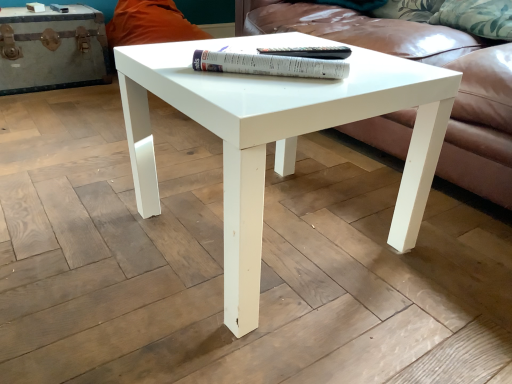
Question: Is white paper at center, the second paperback book when ordered from back to front, located within white leather chest at left?

Choices:
 (A) yes
 (B) no

Answer: (B)

Question: From a real-world perspective, is white leather chest at left below white paper at center, which ranks as the 1th paperback book in front-to-back order?

Choices:
 (A) yes
 (B) no

Answer: (A)

Question: Considering the relative sizes of white leather chest at left and white paper at center, the second paperback book when ordered from back to front, in the image provided, is white leather chest at left wider than white paper at center, the second paperback book when ordered from back to front,?

Choices:
 (A) yes
 (B) no

Answer: (A)

Question: Does white leather chest at left lie behind white paper at center, which ranks as the 1th paperback book in front-to-back order?

Choices:
 (A) no
 (B) yes

Answer: (B)

Question: From the image's perspective, does white leather chest at left appear lower than white paper at center, which ranks as the 1th paperback book in front-to-back order?

Choices:
 (A) no
 (B) yes

Answer: (A)

Question: Is white glossy coffee table at center inside or outside of white leather chest at left?

Choices:
 (A) inside
 (B) outside

Answer: (B)

Question: Is white glossy coffee table at center to the left or to the right of white leather chest at left in the image?

Choices:
 (A) right
 (B) left

Answer: (A)

Question: From a real-world perspective, relative to white leather chest at left, is white glossy coffee table at center vertically above or below?

Choices:
 (A) below
 (B) above

Answer: (B)

Question: Is white glossy coffee table at center in front of or behind white leather chest at left in the image?

Choices:
 (A) front
 (B) behind

Answer: (A)

Question: Based on their positions, is leather couch at center located to the left or right of white paper at center, which ranks as the 1th paperback book in front-to-back order?

Choices:
 (A) left
 (B) right

Answer: (B)

Question: From a real-world perspective, is leather couch at center physically located above or below white paper at center, the second paperback book when ordered from back to front?

Choices:
 (A) above
 (B) below

Answer: (B)

Question: Is leather couch at center wider or thinner than white paper at center, which ranks as the 1th paperback book in front-to-back order?

Choices:
 (A) wide
 (B) thin

Answer: (A)

Question: Is leather couch at center taller or shorter than white paper at center, which ranks as the 1th paperback book in front-to-back order?

Choices:
 (A) short
 (B) tall

Answer: (B)

Question: Is white glossy coffee table at center taller or shorter than white paper at center, the second paperback book when ordered from back to front?

Choices:
 (A) short
 (B) tall

Answer: (B)

Question: Would you say white glossy coffee table at center is inside or outside white paper at center, the second paperback book when ordered from back to front?

Choices:
 (A) inside
 (B) outside

Answer: (B)